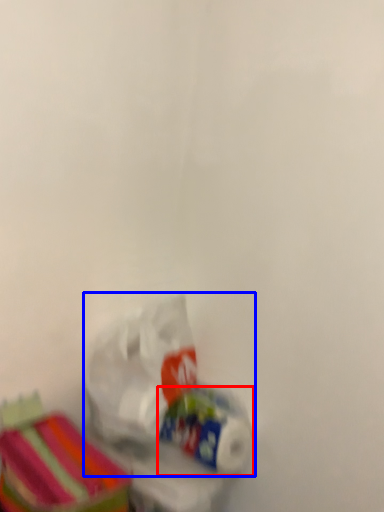
Question: Which object appears farthest to the camera in this image, toilet paper (highlighted by a red box) or plastic bag (highlighted by a blue box)?

Choices:
 (A) toilet paper
 (B) plastic bag

Answer: (A)